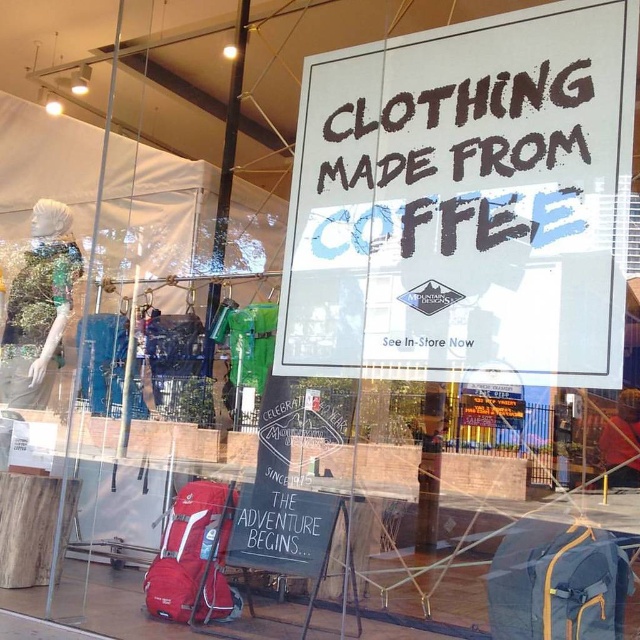
Between white paper sign at center and matte blue backpack at lower right, which one appears on the right side from the viewer's perspective?

From the viewer's perspective, matte blue backpack at lower right appears more on the right side.

Is white paper sign at center taller than matte blue backpack at lower right?

Yes, white paper sign at center is taller than matte blue backpack at lower right.

What are the coordinates of `white paper sign at center` in the screenshot? It's located at (465, 202).

Who is positioned more to the right, matte blue backpack at lower right or matte red backpack at lower left?

matte blue backpack at lower right is more to the right.

Between matte blue backpack at lower right and matte red backpack at lower left, which one has more height?

Standing taller between the two is matte red backpack at lower left.

Locate an element on the screen. matte blue backpack at lower right is located at coordinates (557, 582).

Looking at this image, can you confirm if white paper sign at center is thinner than matte red backpack at lower left?

No.

Does point (545, 45) come farther from viewer compared to point (172, 611)?

No.

Is point (472, 77) more distant than point (209, 604)?

No, it is not.

Identify the location of white paper sign at center. The height and width of the screenshot is (640, 640). (465, 202).